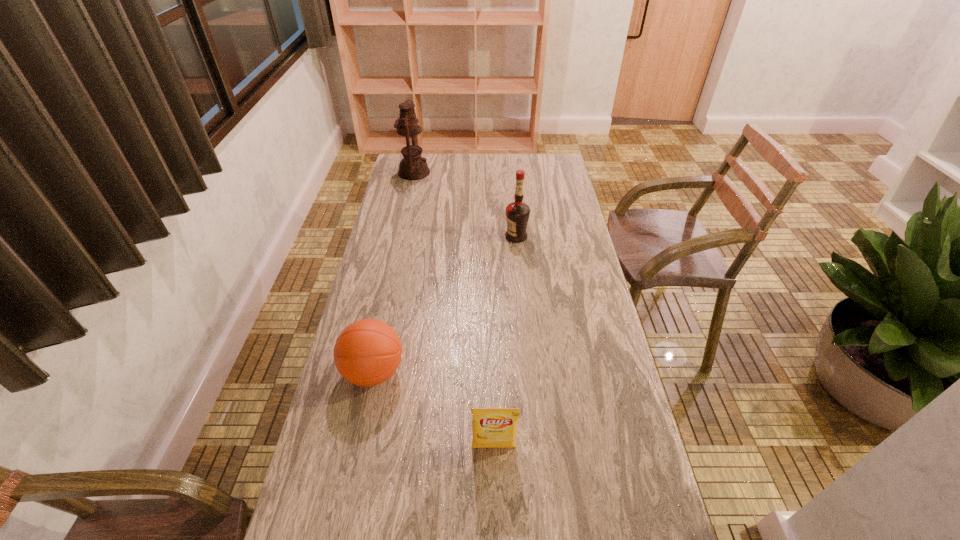
Select which object appears as the second closest to the oil lamp. Please provide its 2D coordinates. Your answer should be formatted as a tuple, i.e. [(x, y)], where the tuple contains the x and y coordinates of a point satisfying the conditions above.

[(367, 352)]

The width and height of the screenshot is (960, 540). In order to click on object that is the third closest to the second nearest object in this screenshot , I will do `click(412, 167)`.

I want to click on free location that satisfies the following two spatial constraints: 1. on the front and back of the second farthest object; 2. on the front side of the basketball, so 529,372.

In order to click on vacant space that satisfies the following two spatial constraints: 1. on the front and back of the rightmost object; 2. on the front of the second object from right to left with the logo in this screenshot , I will do `click(537, 447)`.